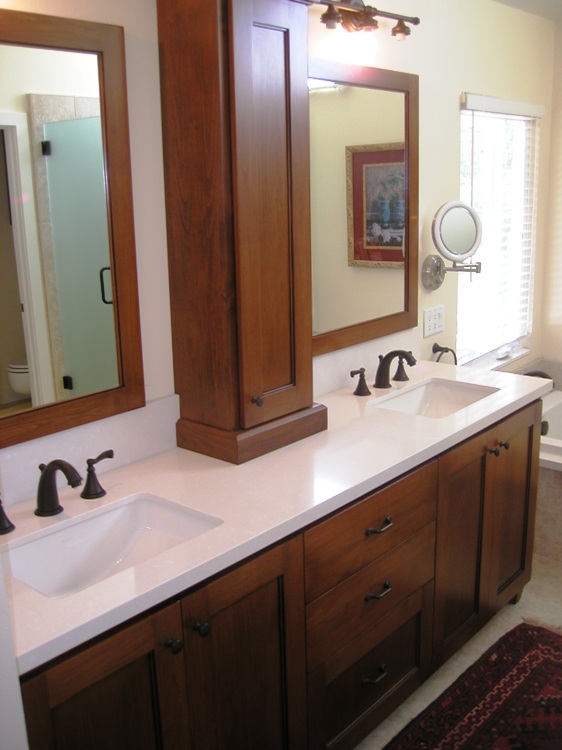
Where is `reflection of shower`? Image resolution: width=562 pixels, height=750 pixels. reflection of shower is located at coordinates (79, 219).